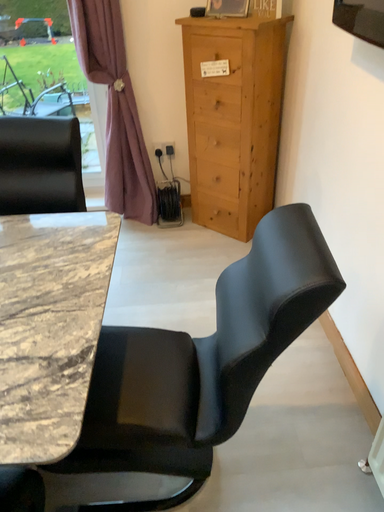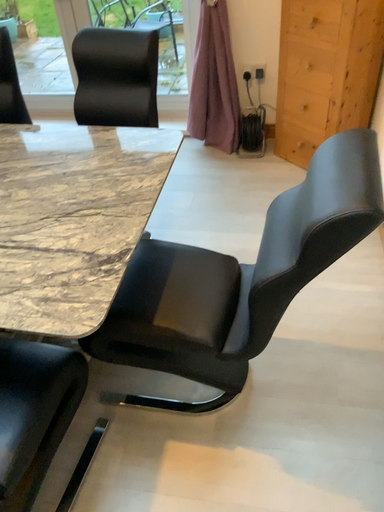
Question: Which way did the camera rotate in the video?

Choices:
 (A) rotated downward
 (B) rotated upward

Answer: (A)